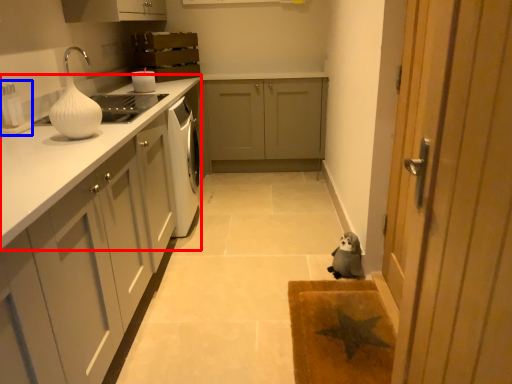
Question: Which object is closer to the camera taking this photo, countertop (highlighted by a red box) or appliance (highlighted by a blue box)?

Choices:
 (A) countertop
 (B) appliance

Answer: (B)